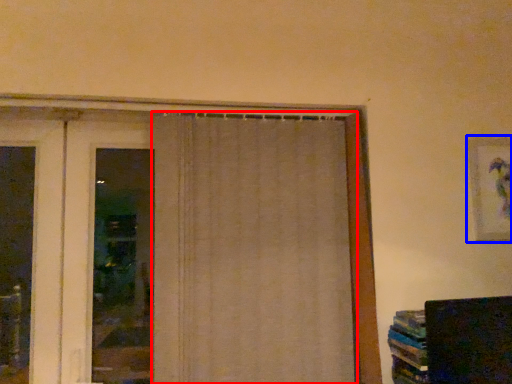
Question: Which point is closer to the camera, curtain (highlighted by a red box) or picture frame (highlighted by a blue box)?

Choices:
 (A) curtain
 (B) picture frame

Answer: (A)